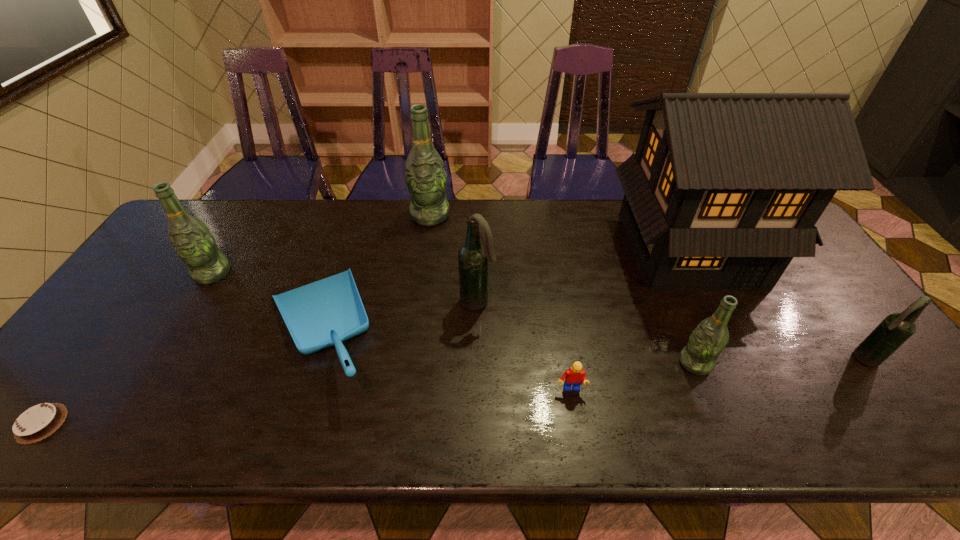
Locate an element on the screen. the tallest object is located at coordinates pos(724,190).

Image resolution: width=960 pixels, height=540 pixels. Find the location of `black dollhouse`. black dollhouse is located at coordinates (724, 190).

The width and height of the screenshot is (960, 540). Find the location of `the tallest beer bottle`. the tallest beer bottle is located at coordinates (425, 176).

The width and height of the screenshot is (960, 540). In order to click on the farthest green beer bottle in this screenshot , I will do `click(425, 176)`.

The height and width of the screenshot is (540, 960). In order to click on the leftmost beer bottle in this screenshot , I will do `click(195, 245)`.

Locate an element on the screen. This screenshot has width=960, height=540. the leftmost green beer bottle is located at coordinates pos(195,245).

The width and height of the screenshot is (960, 540). I want to click on the fifth object from left to right, so click(473, 257).

Find the location of a particular element. the farther dark beer bottle is located at coordinates (473, 257).

I want to click on the rightmost object, so click(896, 328).

The image size is (960, 540). Identify the location of the nearer dark beer bottle. (896, 328).